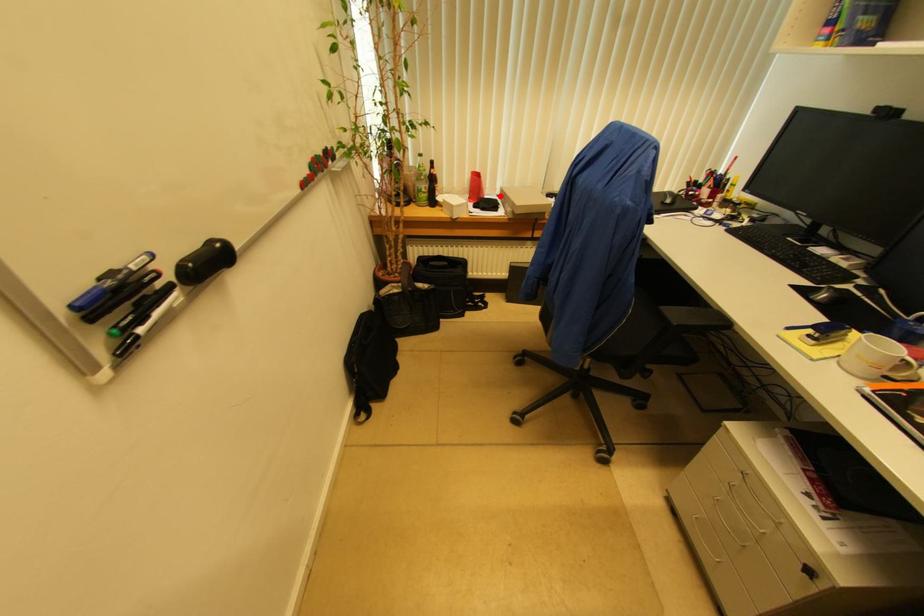
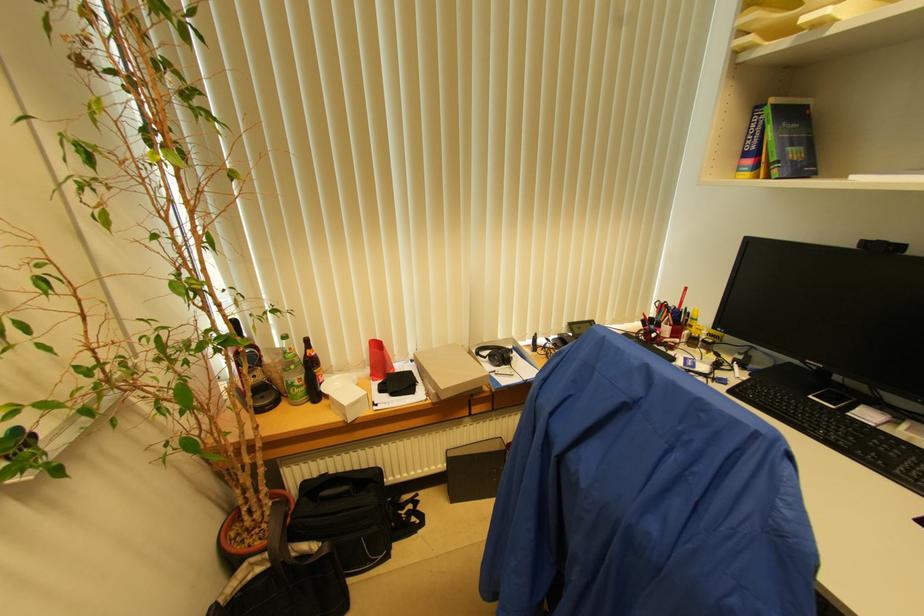
Locate, in the second image, the point that corresponds to the highlighted location in the first image.

(415, 361)